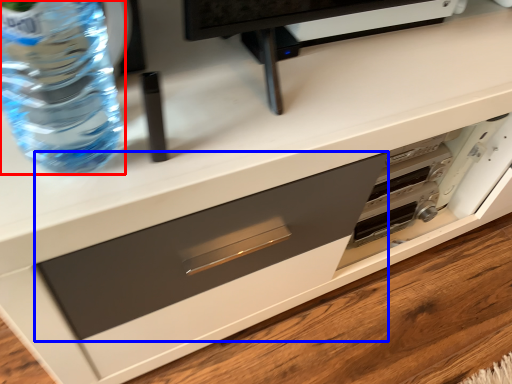
Question: Among these objects, which one is farthest to the camera, bottle (highlighted by a red box) or drawer (highlighted by a blue box)?

Choices:
 (A) bottle
 (B) drawer

Answer: (B)